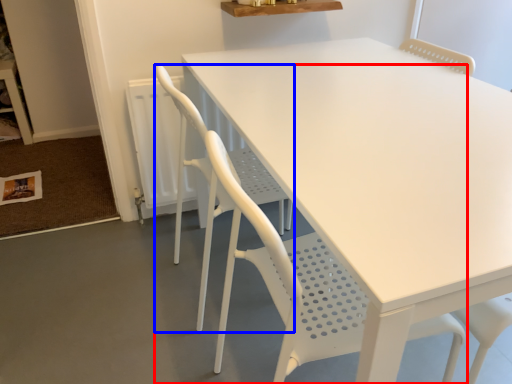
Question: Which point is closer to the camera, chair (highlighted by a red box) or chair (highlighted by a blue box)?

Choices:
 (A) chair
 (B) chair

Answer: (A)